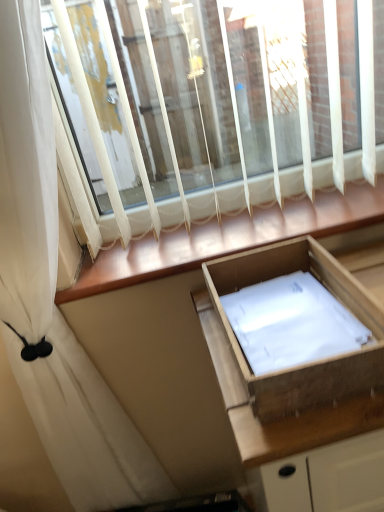
Question: From their relative heights in the image, would you say wooden drawer at center is taller or shorter than white sheer curtain at upper left?

Choices:
 (A) tall
 (B) short

Answer: (B)

Question: Which is correct: wooden drawer at center is inside white sheer curtain at upper left, or outside of it?

Choices:
 (A) inside
 (B) outside

Answer: (B)

Question: Estimate the real-world distances between objects in this image. Which object is farther from the white sheer curtain at upper left?

Choices:
 (A) wooden at lower center
 (B) wooden drawer at center

Answer: (B)

Question: Which object is the farthest from the wooden drawer at center?

Choices:
 (A) wooden at lower center
 (B) white sheer curtain at upper left

Answer: (B)